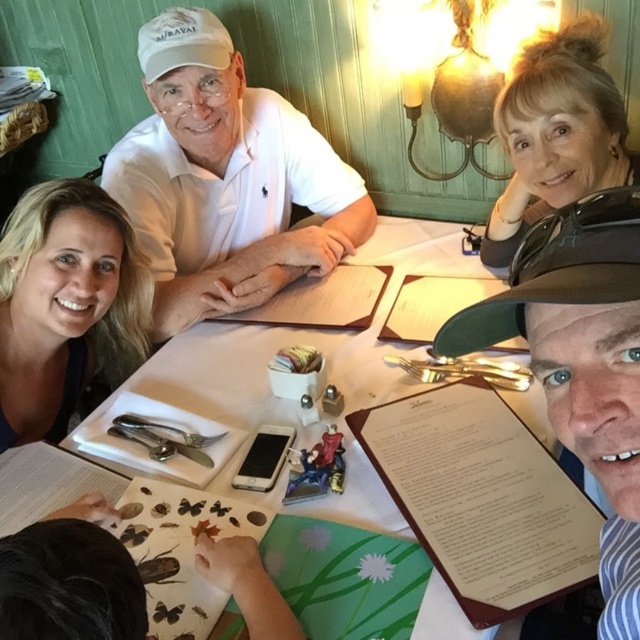
Consider the image. You are sitting at the table and want to hand a menu to the person with blonde hair at left and the person with blonde hair at upper right. Which person is closer to your left side?

The blonde hair at left is closer to your left side since it is positioned to the left of the blonde hair at upper right.

You are a server at the restaurant and need to deliver a drink to the customer whose face is in the foreground. The drink must be placed on the table between the white matte cap at upper center and the white paper menu at center. Is there enough space between these two items for the drink?

The white matte cap at upper center is 75.99 centimeters away from the white paper menu at center. Since the distance between them is sufficient to place a drink, the server can place the drink between the white matte cap at upper center and the white paper menu at center.

You are a waiter approaching the table to take an order. You see the white paper menu at center and the blonde hair at upper right. Which object is closer to the edge of the table?

The white paper menu at center is located below blonde hair at upper right, so the blonde hair at upper right is closer to the edge of the table.